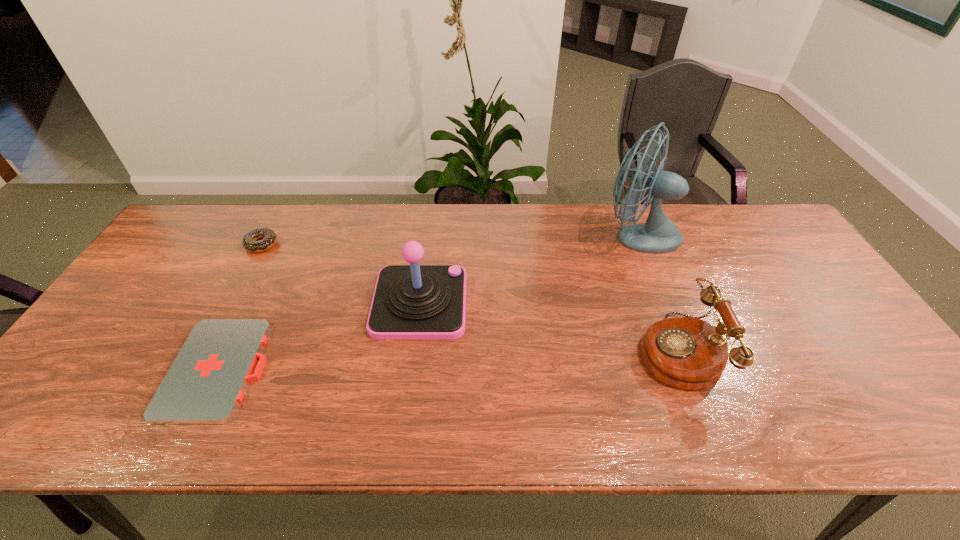
The width and height of the screenshot is (960, 540). I want to click on free space between the doughnut and the shortest object, so click(240, 307).

This screenshot has width=960, height=540. Identify the location of free space between the shortest object and the fourth tallest object. (240, 307).

Image resolution: width=960 pixels, height=540 pixels. What are the coordinates of `empty location between the telephone and the doughnut` in the screenshot? It's located at (468, 297).

Find the location of a particular element. The width and height of the screenshot is (960, 540). object that stands as the fourth closest to the third tallest object is located at coordinates (249, 241).

Identify which object is the second nearest to the fan. Please provide its 2D coordinates. Your answer should be formatted as a tuple, i.e. [(x, y)], where the tuple contains the x and y coordinates of a point satisfying the conditions above.

[(410, 302)]